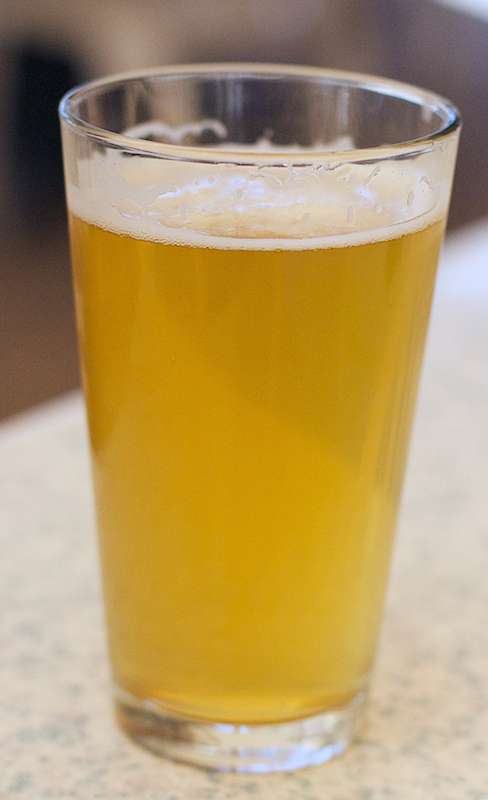
The height and width of the screenshot is (800, 488). Find the location of `tabletop on left of glass`. tabletop on left of glass is located at coordinates (40, 633).